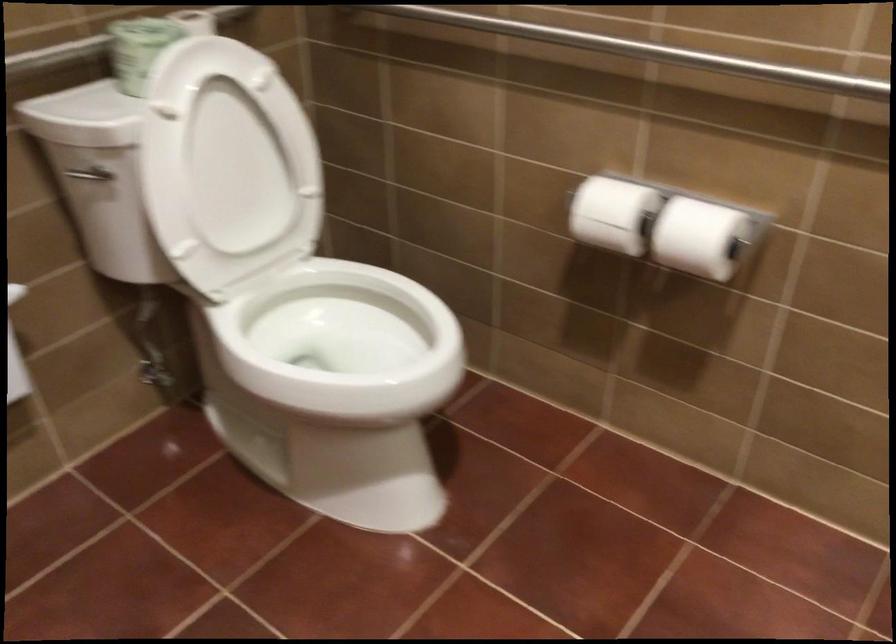
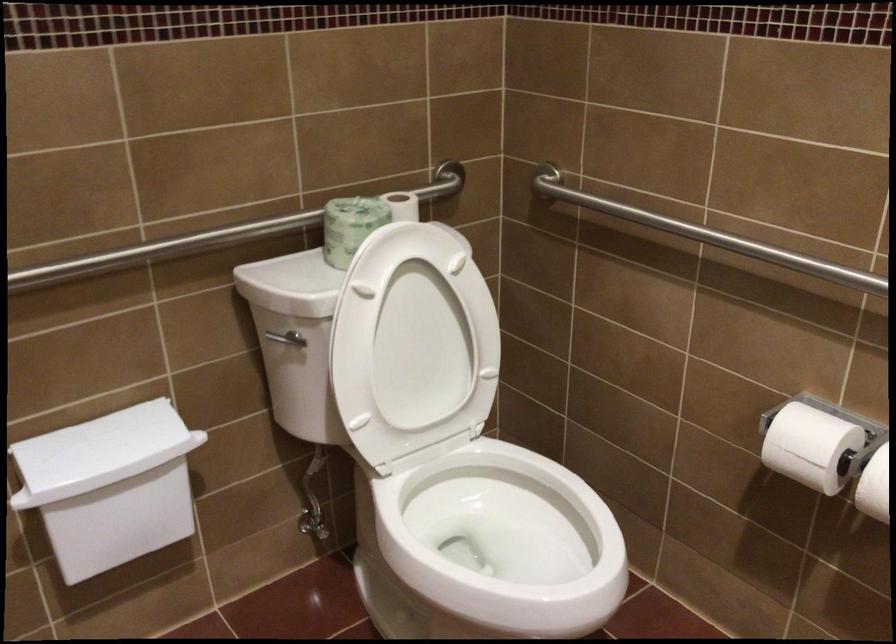
The point at (x=343, y=357) is marked in the first image. Where is the corresponding point in the second image?

(497, 544)